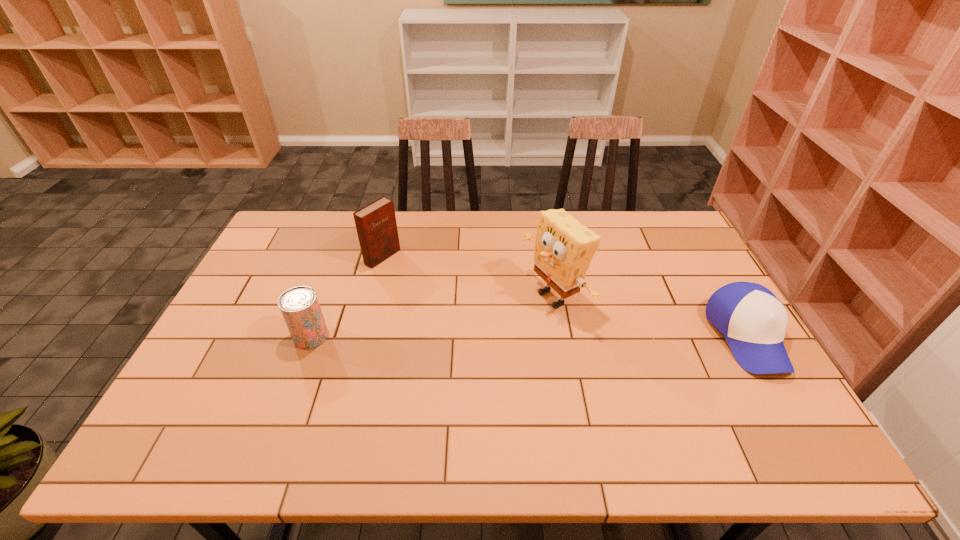
You are a GUI agent. You are given a task and a screenshot of the screen. Output one action in this format:
    pyautogui.click(x=<x>, y=<y>)
    Task: Click on the leftmost object
    
    Given the screenshot: What is the action you would take?
    pyautogui.click(x=300, y=308)

Where is `the shortest object`? Image resolution: width=960 pixels, height=540 pixels. the shortest object is located at coordinates (753, 320).

Identify the location of the rightmost object. This screenshot has height=540, width=960. (753, 320).

Find the location of a particular element. The image size is (960, 540). the third object from right to left is located at coordinates coord(376,226).

Identify the location of diary. (376, 226).

At what (x,y) coordinates should I click in order to perform the action: click on the tallest object. Please return your answer as a coordinate pair (x, y). Image resolution: width=960 pixels, height=540 pixels. Looking at the image, I should click on (564, 248).

Identify the location of the second object from right to left. The height and width of the screenshot is (540, 960). (564, 248).

This screenshot has width=960, height=540. I want to click on vacant space located on the right of the leftmost object, so click(x=368, y=336).

The width and height of the screenshot is (960, 540). In order to click on free region located on the front-facing side of the rightmost object in this screenshot , I will do `click(785, 402)`.

Identify the location of vacant space located on the front cover of the second object from left to right. The image size is (960, 540). (419, 278).